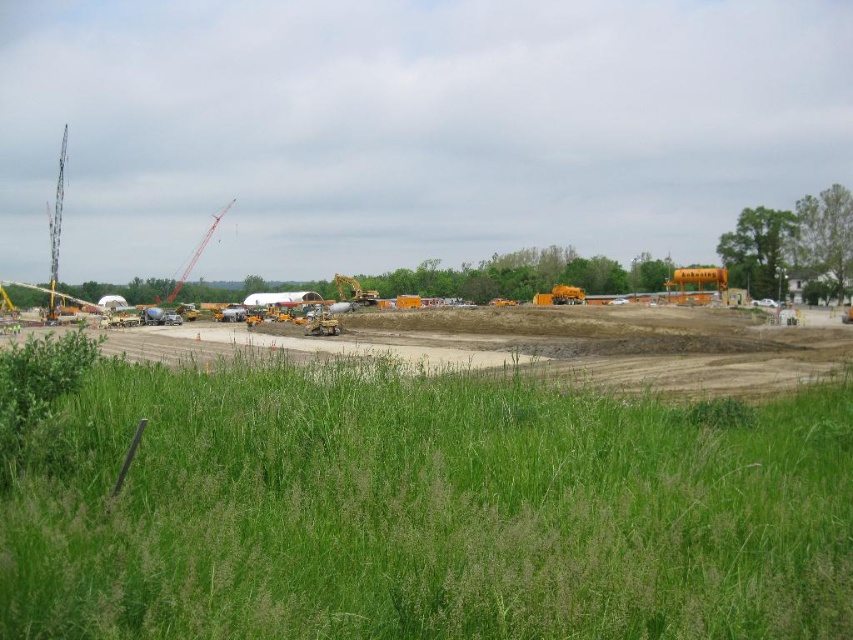
Which is behind, point (631, 433) or point (340, 282)?

The point (340, 282) is behind.

Which is in front, point (103, 493) or point (344, 300)?

Point (103, 493)

Where is `green grass at lower center`? This screenshot has width=853, height=640. green grass at lower center is located at coordinates (422, 509).

Does yellow earth at center have a larger size compared to orange metallic crane at left?

Indeed, yellow earth at center has a larger size compared to orange metallic crane at left.

Looking at this image, is yellow earth at center smaller than orange metallic crane at left?

No.

Does point (492, 339) come closer to viewer compared to point (216, 224)?

Yes, it is.

Locate an element on the screen. yellow earth at center is located at coordinates (569, 342).

This screenshot has height=640, width=853. What do you see at coordinates (195, 253) in the screenshot?
I see `orange metallic crane at left` at bounding box center [195, 253].

Does orange metallic crane at left appear under yellow metallic excavator at center?

Actually, orange metallic crane at left is above yellow metallic excavator at center.

Locate an element on the screen. The image size is (853, 640). orange metallic crane at left is located at coordinates (195, 253).

You are a GUI agent. You are given a task and a screenshot of the screen. Output one action in this format:
    pyautogui.click(x=<x>, y=<y>)
    Task: Click on the orange metallic crane at left
    
    Given the screenshot: What is the action you would take?
    pyautogui.click(x=195, y=253)